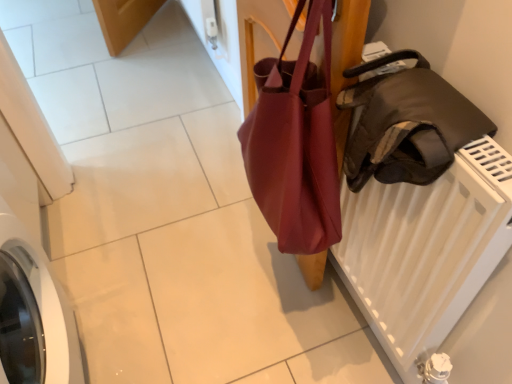
You are a GUI agent. You are given a task and a screenshot of the screen. Output one action in this format:
    pyautogui.click(x=<x>, y=<y>)
    Task: Click on the free spot in front of matte brown bag at center
    
    Given the screenshot: What is the action you would take?
    pyautogui.click(x=251, y=303)